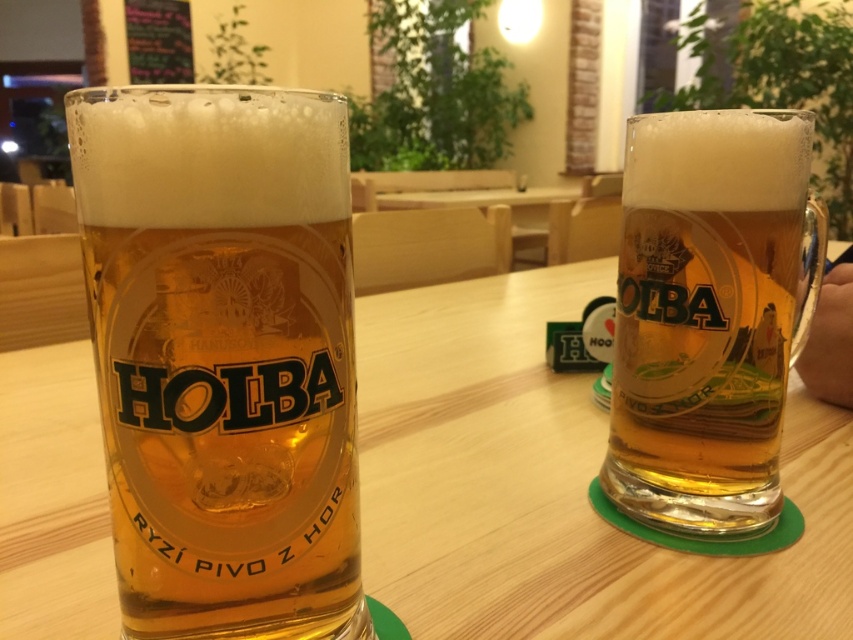
Who is positioned more to the right, translucent glass mug at center or translucent glass mug at right?

translucent glass mug at right is more to the right.

Between translucent glass mug at center and translucent glass mug at right, which one appears on the left side from the viewer's perspective?

From the viewer's perspective, translucent glass mug at center appears more on the left side.

Is point (167, 269) positioned in front of point (624, 262)?

Yes, it is.

Find the location of `translucent glass mug at center`. translucent glass mug at center is located at coordinates (223, 355).

Which is behind, point (836, 422) or point (650, 266)?

Point (836, 422)

Which is in front, point (498, 595) or point (643, 262)?

Point (498, 595)

In order to click on wooden table at center in this screenshot , I will do click(x=555, y=484).

Who is higher up, wooden table at center or translucent glass mug at center?

wooden table at center is above.

Is wooden table at center positioned in front of translucent glass mug at center?

No, it is behind translucent glass mug at center.

Image resolution: width=853 pixels, height=640 pixels. What do you see at coordinates (555, 484) in the screenshot?
I see `wooden table at center` at bounding box center [555, 484].

This screenshot has width=853, height=640. Identify the location of wooden table at center. (555, 484).